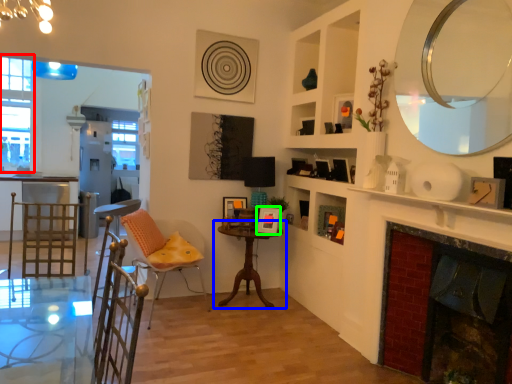
Question: Which object is the farthest from window (highlighted by a red box)? Choose among these: table (highlighted by a blue box) or picture frame (highlighted by a green box).

Choices:
 (A) table
 (B) picture frame

Answer: (B)